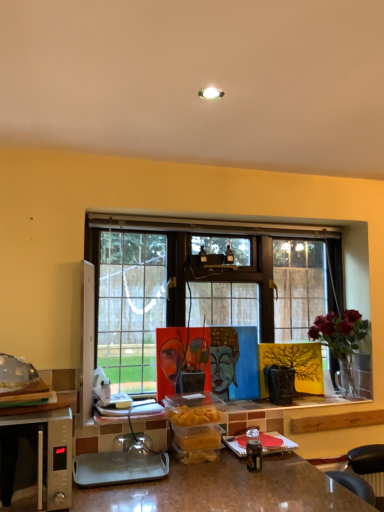
Question: Is translucent glass food at left surrounded by deep red flowers in glass vase at right?

Choices:
 (A) yes
 (B) no

Answer: (B)

Question: Is deep red flowers in glass vase at right further to camera compared to translucent glass food at left?

Choices:
 (A) yes
 (B) no

Answer: (A)

Question: Is deep red flowers in glass vase at right turned away from translucent glass food at left?

Choices:
 (A) yes
 (B) no

Answer: (B)

Question: Does deep red flowers in glass vase at right turn towards translucent glass food at left?

Choices:
 (A) no
 (B) yes

Answer: (A)

Question: Does deep red flowers in glass vase at right appear on the right side of translucent glass food at left?

Choices:
 (A) no
 (B) yes

Answer: (B)

Question: Is deep red flowers in glass vase at right in front of or behind silver metallic microwave oven at lower left in the image?

Choices:
 (A) behind
 (B) front

Answer: (A)

Question: Is deep red flowers in glass vase at right wider or thinner than silver metallic microwave oven at lower left?

Choices:
 (A) thin
 (B) wide

Answer: (A)

Question: From a real-world perspective, is deep red flowers in glass vase at right physically located above or below silver metallic microwave oven at lower left?

Choices:
 (A) below
 (B) above

Answer: (B)

Question: Is deep red flowers in glass vase at right situated inside silver metallic microwave oven at lower left or outside?

Choices:
 (A) inside
 (B) outside

Answer: (B)

Question: From the image's perspective, relative to translucent glass food at left, is silver metallic microwave oven at lower left above or below?

Choices:
 (A) above
 (B) below

Answer: (B)

Question: Considering the positions of silver metallic microwave oven at lower left and translucent glass food at left in the image, is silver metallic microwave oven at lower left taller or shorter than translucent glass food at left?

Choices:
 (A) short
 (B) tall

Answer: (B)

Question: From a real-world perspective, relative to translucent glass food at left, is silver metallic microwave oven at lower left vertically above or below?

Choices:
 (A) above
 (B) below

Answer: (B)

Question: Is point (56, 437) positioned closer to the camera than point (9, 378)?

Choices:
 (A) farther
 (B) closer

Answer: (B)

Question: Considering the positions of silver metallic microwave oven at lower left and deep red flowers in glass vase at right in the image, is silver metallic microwave oven at lower left bigger or smaller than deep red flowers in glass vase at right?

Choices:
 (A) big
 (B) small

Answer: (A)

Question: Is silver metallic microwave oven at lower left wider or thinner than deep red flowers in glass vase at right?

Choices:
 (A) wide
 (B) thin

Answer: (A)